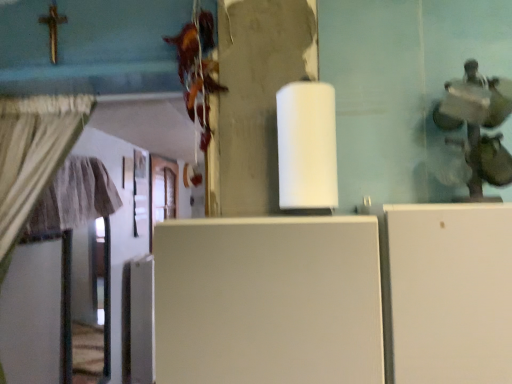
Question: Does wooden at left have a greater height compared to white matte refrigerator at center?

Choices:
 (A) yes
 (B) no

Answer: (A)

Question: From the image's perspective, is wooden at left on top of white matte refrigerator at center?

Choices:
 (A) no
 (B) yes

Answer: (B)

Question: Does wooden at left have a lesser height compared to white matte refrigerator at center?

Choices:
 (A) yes
 (B) no

Answer: (B)

Question: Does wooden at left have a greater width compared to white matte refrigerator at center?

Choices:
 (A) yes
 (B) no

Answer: (B)

Question: Is wooden at left in contact with white matte refrigerator at center?

Choices:
 (A) yes
 (B) no

Answer: (B)

Question: Is wooden at left far away from white matte refrigerator at center?

Choices:
 (A) no
 (B) yes

Answer: (B)

Question: From a real-world perspective, does white matte refrigerator at center sit lower than wooden at left?

Choices:
 (A) no
 (B) yes

Answer: (B)

Question: Considering the relative sizes of white matte refrigerator at center and wooden at left in the image provided, is white matte refrigerator at center bigger than wooden at left?

Choices:
 (A) yes
 (B) no

Answer: (A)

Question: Is white matte refrigerator at center outside wooden at left?

Choices:
 (A) yes
 (B) no

Answer: (A)

Question: Considering the relative positions of white matte refrigerator at center and wooden at left in the image provided, is white matte refrigerator at center to the right of wooden at left from the viewer's perspective?

Choices:
 (A) yes
 (B) no

Answer: (A)

Question: Is white matte refrigerator at center at the left side of wooden at left?

Choices:
 (A) no
 (B) yes

Answer: (A)

Question: Considering the relative sizes of white matte refrigerator at center and wooden at left in the image provided, is white matte refrigerator at center wider than wooden at left?

Choices:
 (A) yes
 (B) no

Answer: (A)

Question: Considering the positions of white matte refrigerator at center and wooden at left in the image, is white matte refrigerator at center wider or thinner than wooden at left?

Choices:
 (A) wide
 (B) thin

Answer: (A)